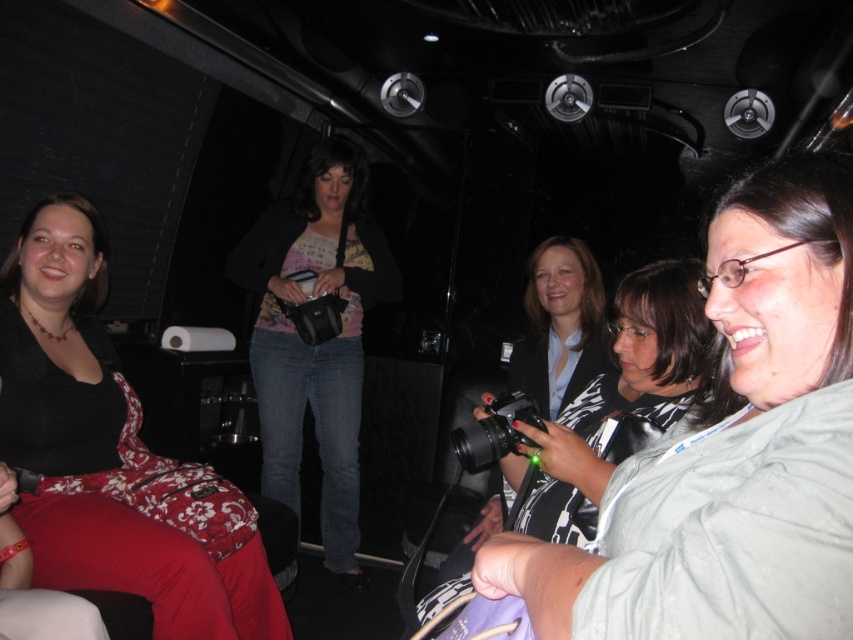
Which is in front, point (119, 541) or point (508, 426)?

Point (508, 426)

Can you confirm if matte black top at left is wider than black plastic camera at center?

Yes, matte black top at left is wider than black plastic camera at center.

This screenshot has width=853, height=640. Find the location of `matte black top at left`. matte black top at left is located at coordinates (106, 449).

Can you confirm if light gray fabric shirt at center is taller than black plastic camera at center?

Yes.

Between light gray fabric shirt at center and black plastic camera at center, which one appears on the left side from the viewer's perspective?

black plastic camera at center is more to the left.

This screenshot has width=853, height=640. Identify the location of light gray fabric shirt at center. (730, 449).

Who is higher up, matte pink shirt at center or black plastic camera at center?

matte pink shirt at center is higher up.

In the scene shown: Is matte pink shirt at center taller than black plastic camera at center?

Yes.

Does point (331, 179) lie behind point (468, 448)?

That is True.

I want to click on matte pink shirt at center, so (x=320, y=342).